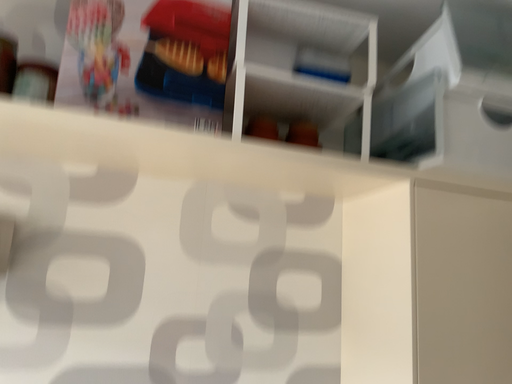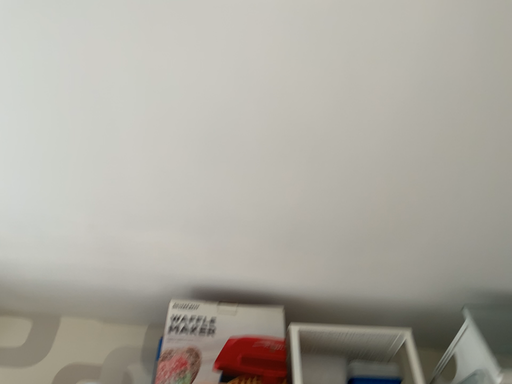
Question: Which way did the camera rotate in the video?

Choices:
 (A) rotated left
 (B) rotated right

Answer: (A)